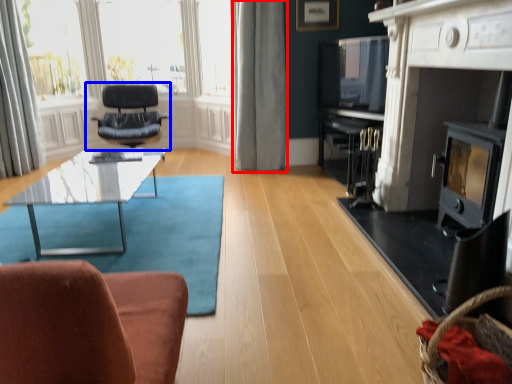
Question: Which point is closer to the camera, curtain (highlighted by a red box) or chair (highlighted by a blue box)?

Choices:
 (A) curtain
 (B) chair

Answer: (A)